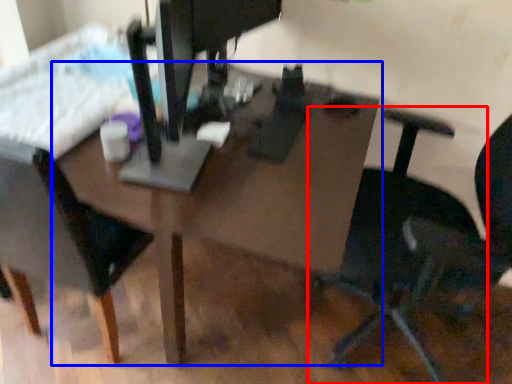
Question: Which object appears farthest to the camera in this image, chair (highlighted by a red box) or table (highlighted by a blue box)?

Choices:
 (A) chair
 (B) table

Answer: (B)